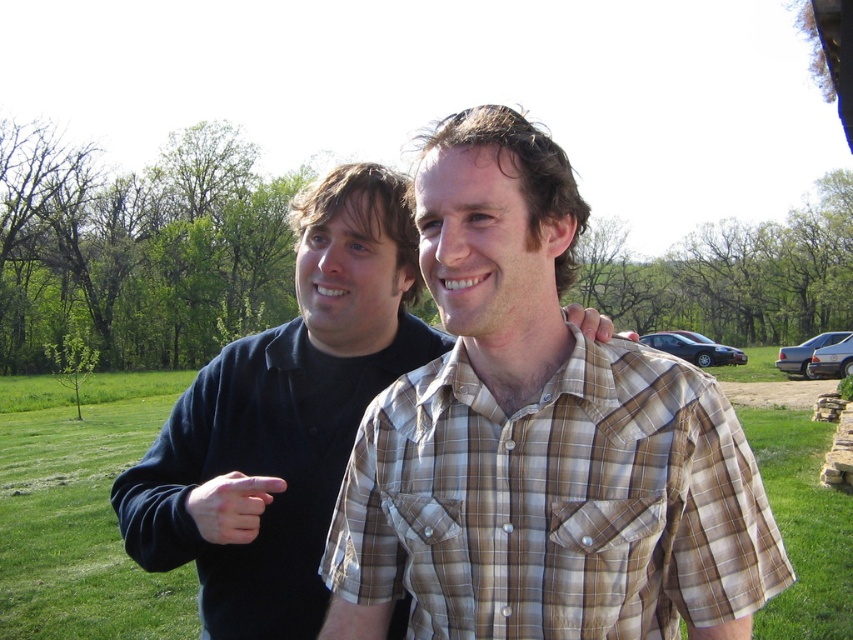
You are taking a photo of two friends in a park. You notice two points in the scene labeled as point A and point B. The coordinates for point A are point A at (668, 452) and point B are point B at (584, 333). Based on their positions, which point is closer to the camera?

Point A at (668, 452) is closer to the camera than point B at (584, 333).